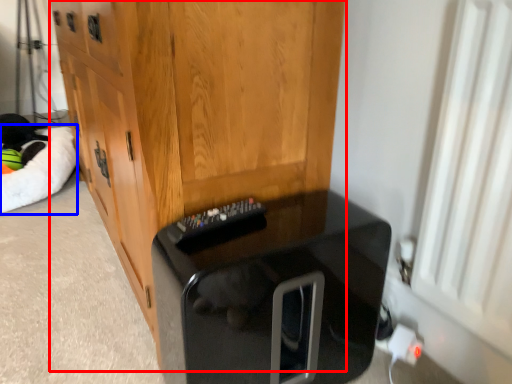
Question: Which object appears closest to the camera in this image, cabinetry (highlighted by a red box) or cat bed (highlighted by a blue box)?

Choices:
 (A) cabinetry
 (B) cat bed

Answer: (A)